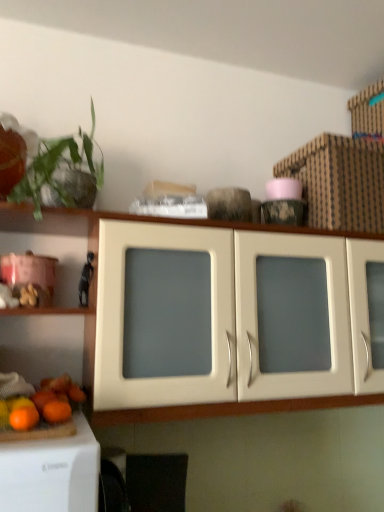
Question: Is green leafy plant at upper left a part of orange matte at lower left, arranged as the first orange when viewed from the front?

Choices:
 (A) yes
 (B) no

Answer: (B)

Question: Are orange matte at lower left, the 2th orange positioned from the back, and green leafy plant at upper left located far from each other?

Choices:
 (A) yes
 (B) no

Answer: (B)

Question: From a real-world perspective, is orange matte at lower left, the 2th orange positioned from the back, located beneath green leafy plant at upper left?

Choices:
 (A) yes
 (B) no

Answer: (A)

Question: Does orange matte at lower left, the 2th orange positioned from the back, turn towards green leafy plant at upper left?

Choices:
 (A) no
 (B) yes

Answer: (A)

Question: Is orange matte at lower left, arranged as the first orange when viewed from the front, thinner than green leafy plant at upper left?

Choices:
 (A) yes
 (B) no

Answer: (A)

Question: Is orange matte at lower left, the 2th orange positioned from the back, in front of or behind black matte figurine at left in the image?

Choices:
 (A) behind
 (B) front

Answer: (B)

Question: Considering the positions of orange matte at lower left, the 2th orange positioned from the back, and black matte figurine at left in the image, is orange matte at lower left, the 2th orange positioned from the back, wider or thinner than black matte figurine at left?

Choices:
 (A) thin
 (B) wide

Answer: (B)

Question: In the image, is orange matte at lower left, the 2th orange positioned from the back, on the left side or the right side of black matte figurine at left?

Choices:
 (A) left
 (B) right

Answer: (A)

Question: Is orange matte at lower left, the 2th orange positioned from the back, spatially inside black matte figurine at left, or outside of it?

Choices:
 (A) outside
 (B) inside

Answer: (A)

Question: From their relative heights in the image, would you say black matte figurine at left is taller or shorter than matte white cabinet at center?

Choices:
 (A) tall
 (B) short

Answer: (B)

Question: Considering the positions of black matte figurine at left and matte white cabinet at center in the image, is black matte figurine at left bigger or smaller than matte white cabinet at center?

Choices:
 (A) small
 (B) big

Answer: (A)

Question: From a real-world perspective, is black matte figurine at left physically located above or below matte white cabinet at center?

Choices:
 (A) above
 (B) below

Answer: (A)

Question: From the image's perspective, is black matte figurine at left located above or below matte white cabinet at center?

Choices:
 (A) below
 (B) above

Answer: (B)

Question: Is matte white cabinet at center wider or thinner than orange matte at lower left, arranged as the first orange when viewed from the front?

Choices:
 (A) wide
 (B) thin

Answer: (A)

Question: Considering the positions of matte white cabinet at center and orange matte at lower left, arranged as the first orange when viewed from the front, in the image, is matte white cabinet at center taller or shorter than orange matte at lower left, arranged as the first orange when viewed from the front,?

Choices:
 (A) short
 (B) tall

Answer: (B)